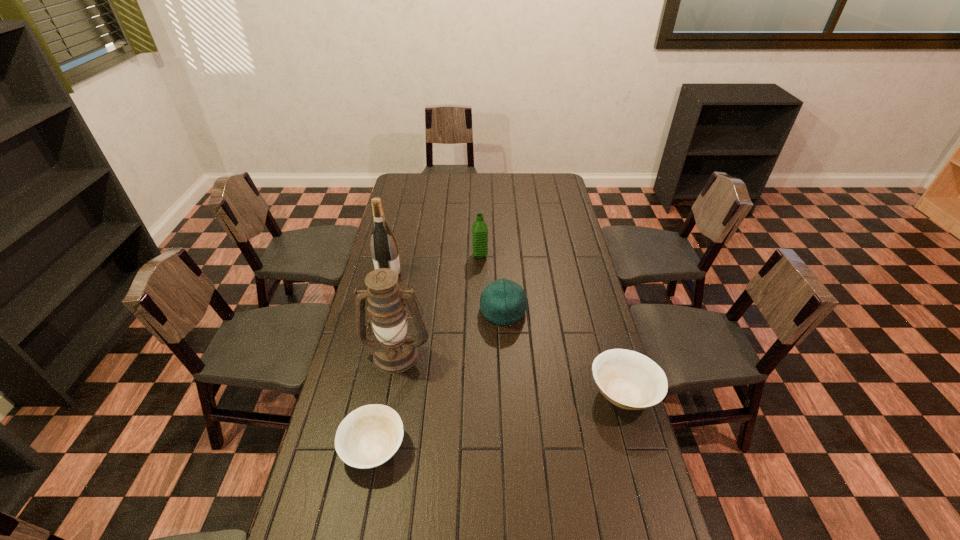
Please mark a free spot for a new bowl to balance the arrangement. Please provide its 2D coordinates. Your answer should be formatted as a tuple, i.e. [(x, y)], where the tuple contains the x and y coordinates of a point satisfying the conditions above.

[(505, 419)]